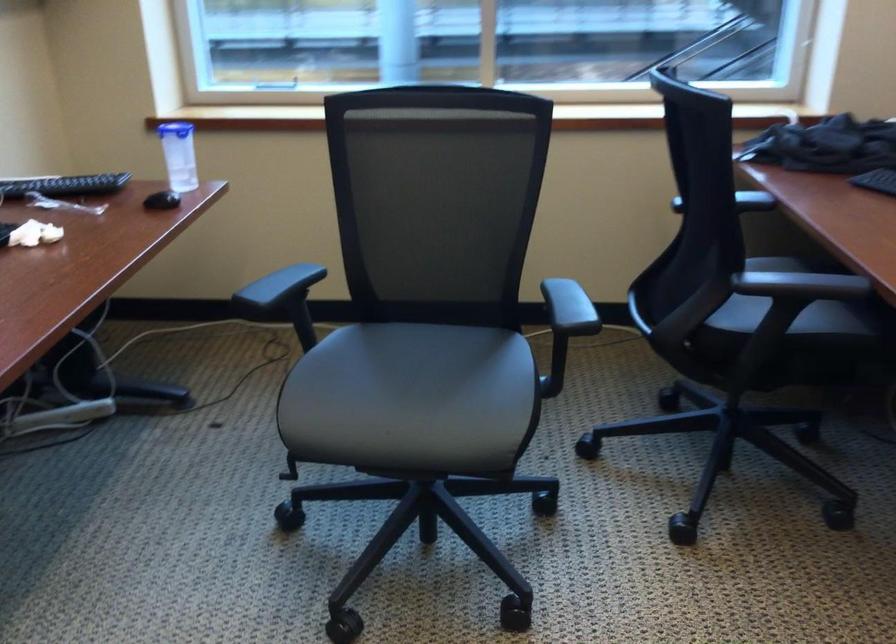
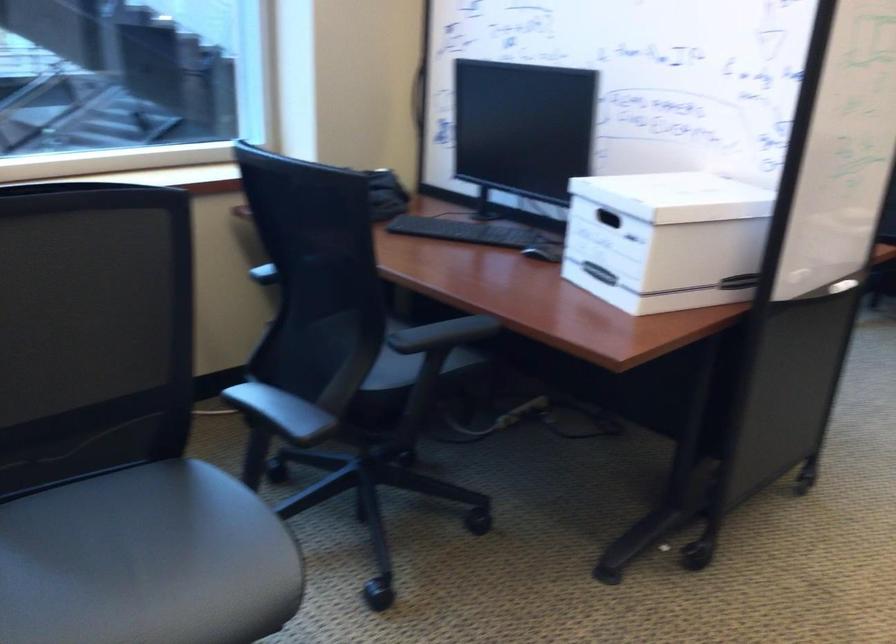
In the second image, find the point that corresponds to pixel 771 314 in the first image.

(410, 368)